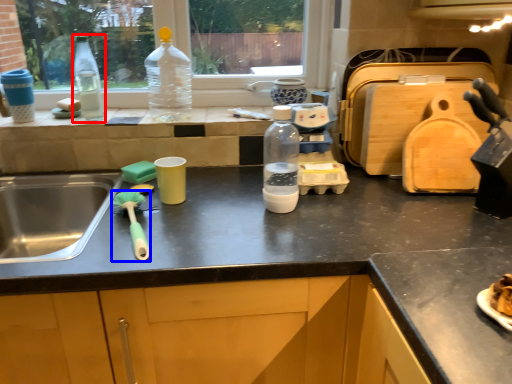
Question: Which object appears farthest to the camera in this image, bottle (highlighted by a red box) or brush (highlighted by a blue box)?

Choices:
 (A) bottle
 (B) brush

Answer: (A)